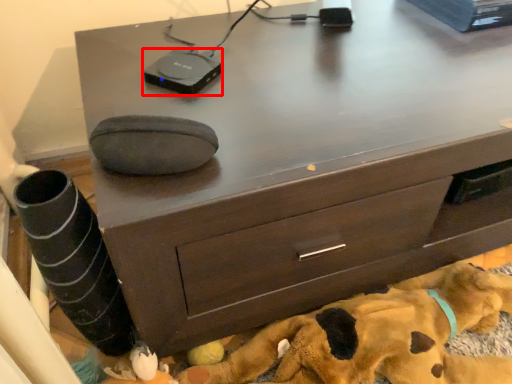
Question: From the image, what is the correct spatial relationship of gadget (annotated by the red box) in relation to dog?

Choices:
 (A) left
 (B) right

Answer: (A)